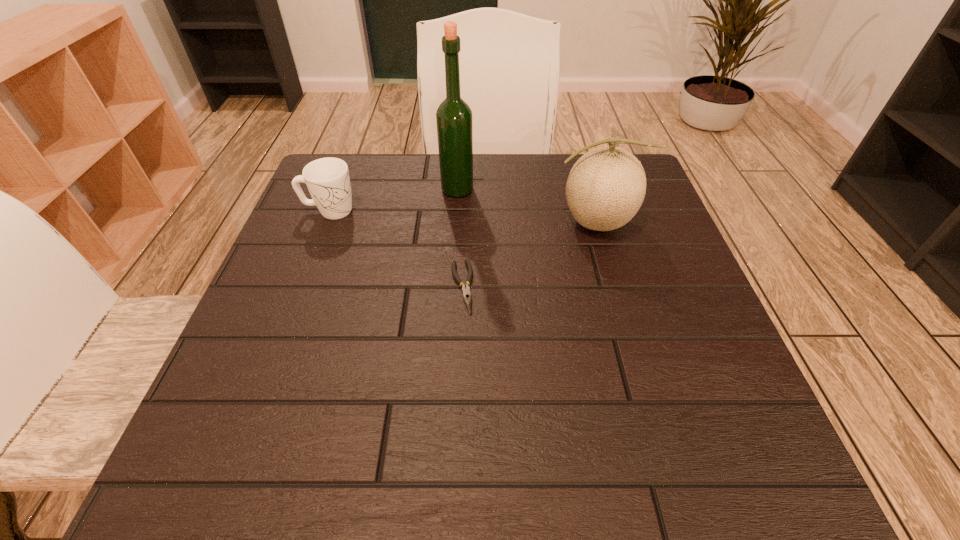
At what (x,y) coordinates should I click in order to perform the action: click on vacant space located on the right of the nearest object. Please return your answer as a coordinate pair (x, y). The image size is (960, 540). Looking at the image, I should click on (547, 287).

What are the coordinates of `liquor that is at the far edge` in the screenshot? It's located at (454, 121).

Locate an element on the screen. The image size is (960, 540). cantaloup located in the far edge section of the desktop is located at coordinates (606, 187).

Identify the location of mug that is positioned at the far edge. (328, 181).

Identify the location of object at the left edge. (328, 181).

Locate an element on the screen. The image size is (960, 540). object at the right edge is located at coordinates (606, 187).

Where is `object at the far left corner`? This screenshot has width=960, height=540. object at the far left corner is located at coordinates (328, 181).

I want to click on object present at the far right corner, so click(x=606, y=187).

The image size is (960, 540). Find the location of `free space at the far edge`. free space at the far edge is located at coordinates (554, 171).

Image resolution: width=960 pixels, height=540 pixels. What are the coordinates of `vacant region at the near edge of the desktop` in the screenshot? It's located at (390, 483).